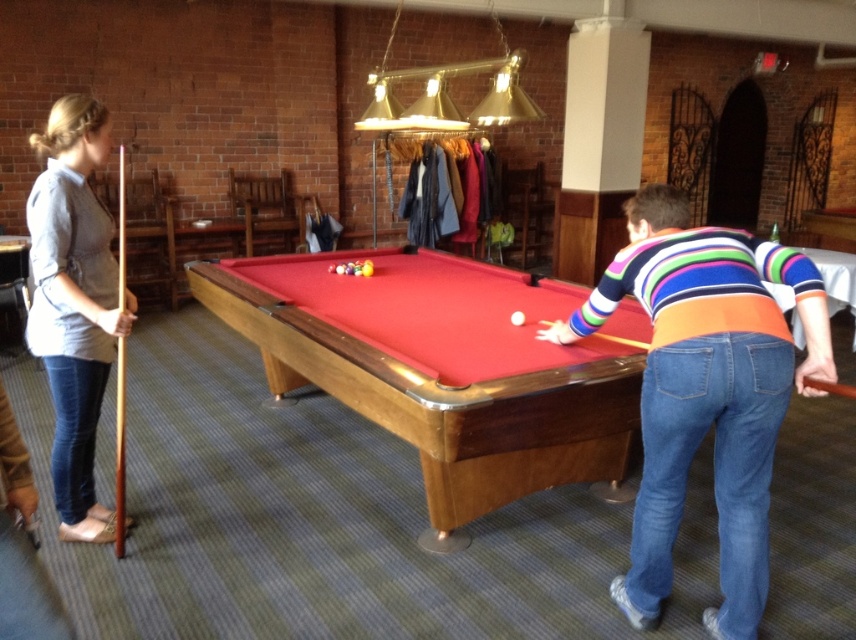
You are a delivery robot that is 0.8 meters wide. You need to move from the entrance to the kitchen, which is behind the wooden pool table at center. The only path available is next to the matte gray shirt at left. Can you pass through this path without touching any objects?

The distance between the wooden pool table at center and the matte gray shirt at left is 1.20 meters. Since the robot is 0.8 meters wide, it can pass through the path as there is enough space between them.

You are standing at the edge of the pool table and want to place a coin on the point that is closer to you. Which point should you choose between point (645, 512) and point (86, 113)?

Point (645, 512) is closer to the camera than point (86, 113), so you should choose point (645, 512).